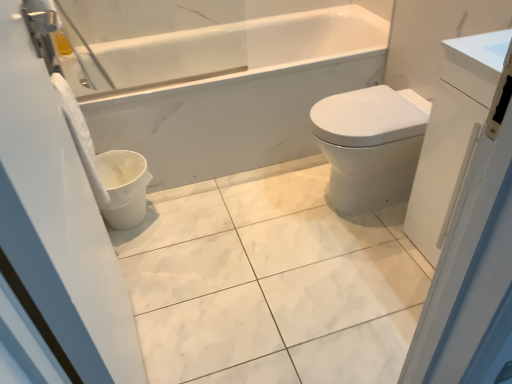
Question: In the image, is white glossy screen door at left, which ranks as the first screen door in left-to-right order, positioned in front of or behind white matte toilet paper at left?

Choices:
 (A) front
 (B) behind

Answer: (A)

Question: Is point (8, 218) positioned closer to the camera than point (97, 201)?

Choices:
 (A) closer
 (B) farther

Answer: (A)

Question: Which is farther from the white glossy bidet at right?

Choices:
 (A) white glossy screen door at left, placed as the second screen door when sorted from right to left
 (B) white glossy toilet bowl at lower left
 (C) white glossy cabinet at right, which ranks as the second screen door in left-to-right order
 (D) white marble tile at center
 (E) white matte toilet paper at left

Answer: (A)

Question: Which is nearer to the white marble tile at center?

Choices:
 (A) white matte toilet paper at left
 (B) white glossy bidet at right
 (C) white glossy screen door at left, placed as the second screen door when sorted from right to left
 (D) white glossy toilet bowl at lower left
 (E) white glossy cabinet at right, the 1th screen door positioned from the right

Answer: (B)